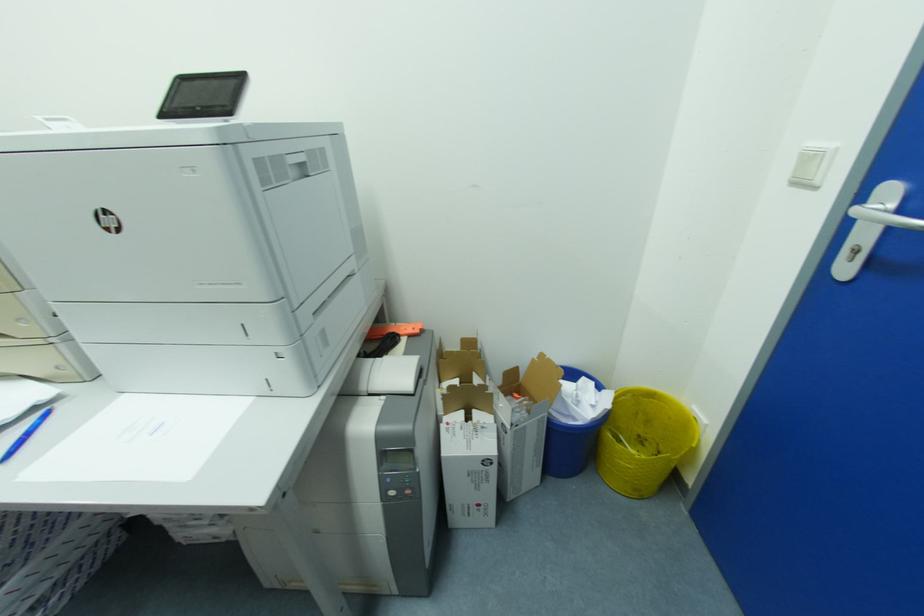
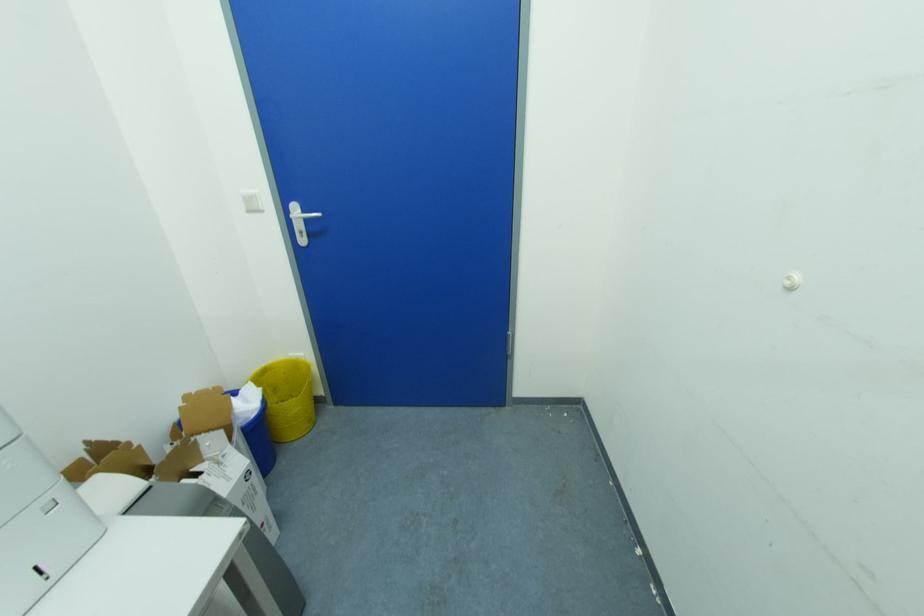
Based on the continuous images, in which direction is the camera rotating?

The camera's rotation is toward right-down.